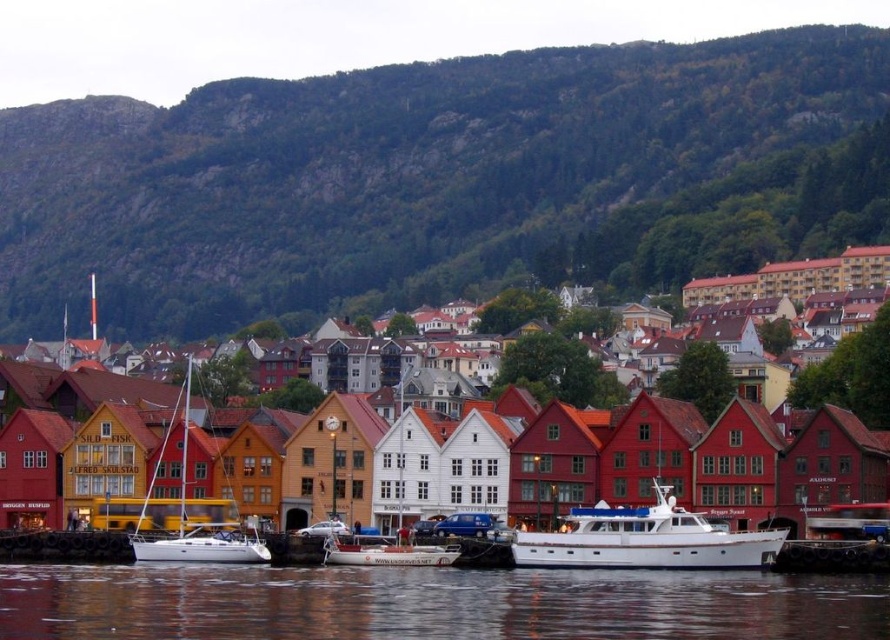
Who is lower down, transparent water at lower center or white matte boat at center?

Positioned lower is white matte boat at center.

Who is shorter, transparent water at lower center or white matte boat at center?

white matte boat at center

The width and height of the screenshot is (890, 640). What are the coordinates of `transparent water at lower center` in the screenshot? It's located at (431, 604).

Can you confirm if wooden houses at center is positioned to the left of transparent water at lower center?

Indeed, wooden houses at center is positioned on the left side of transparent water at lower center.

Is point (734, 337) closer to camera compared to point (475, 579)?

No, (734, 337) is behind (475, 579).

This screenshot has width=890, height=640. Find the location of `wooden houses at center`. wooden houses at center is located at coordinates (136, 428).

Find the location of a particular element. wooden houses at center is located at coordinates (136, 428).

Measure the distance between white matte sailboat at center and camera.

79.40 meters

Is white matte sailboat at center bigger than white matte boat at center?

Correct, white matte sailboat at center is larger in size than white matte boat at center.

Where is `white matte sailboat at center`? The height and width of the screenshot is (640, 890). white matte sailboat at center is located at coordinates (192, 520).